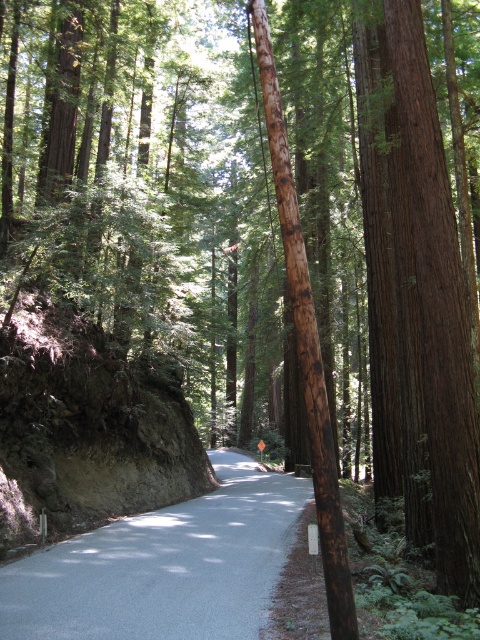
Based on the scene description, where is the brown rough textured tree at right located in the image?

The brown rough textured tree at right is located at point [417,301] in the image.

You are a hiker who needs to determine which object is larger between the brown rough textured tree at right and the brown rough wooden pole at center. Based on the scene, which one is larger?

The brown rough textured tree at right is bigger than the brown rough wooden pole at center, so the tree is larger.

You are standing on the forest road and want to take a photo of the brown rough textured tree at right. If your camera has a maximum zoom range of 5 meters, will you need to move closer to capture the tree in focus?

The brown rough textured tree at right is 7.34 meters away from you. Since your camera can only zoom up to 5 meters, you need to move closer to ensure the tree is in focus.